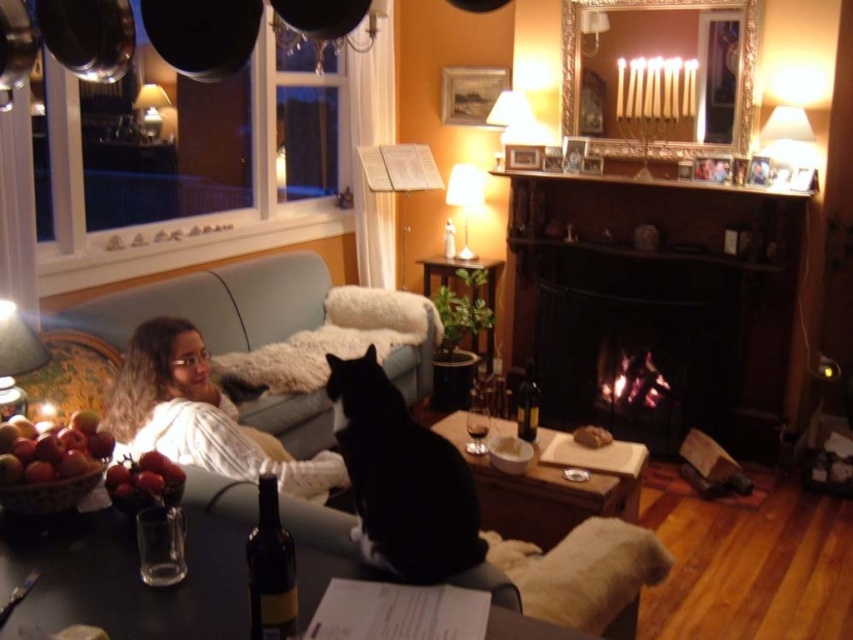
Does point (560, 492) come behind point (526, 396)?

No, (560, 492) is closer to viewer.

Can you confirm if wooden cutting board at center is wider than dark glass bottle at center?

Indeed, wooden cutting board at center has a greater width compared to dark glass bottle at center.

The image size is (853, 640). Identify the location of wooden cutting board at center. (538, 492).

Based on the photo, which of these two, light blue fabric couch at center or fuzzy white blanket at lower center, stands taller?

light blue fabric couch at center is taller.

Is the position of light blue fabric couch at center less distant than that of fuzzy white blanket at lower center?

No, light blue fabric couch at center is further to the viewer.

What do you see at coordinates (216, 304) in the screenshot? This screenshot has width=853, height=640. I see `light blue fabric couch at center` at bounding box center [216, 304].

Find the location of a particular element. This screenshot has height=640, width=853. light blue fabric couch at center is located at coordinates (216, 304).

Is shiny red grapes at lower left above dark glass bottle at center?

Actually, shiny red grapes at lower left is below dark glass bottle at center.

Is point (108, 474) less distant than point (524, 422)?

Yes, it is in front of point (524, 422).

What are the coordinates of `shiny red grapes at lower left` in the screenshot? It's located at (144, 477).